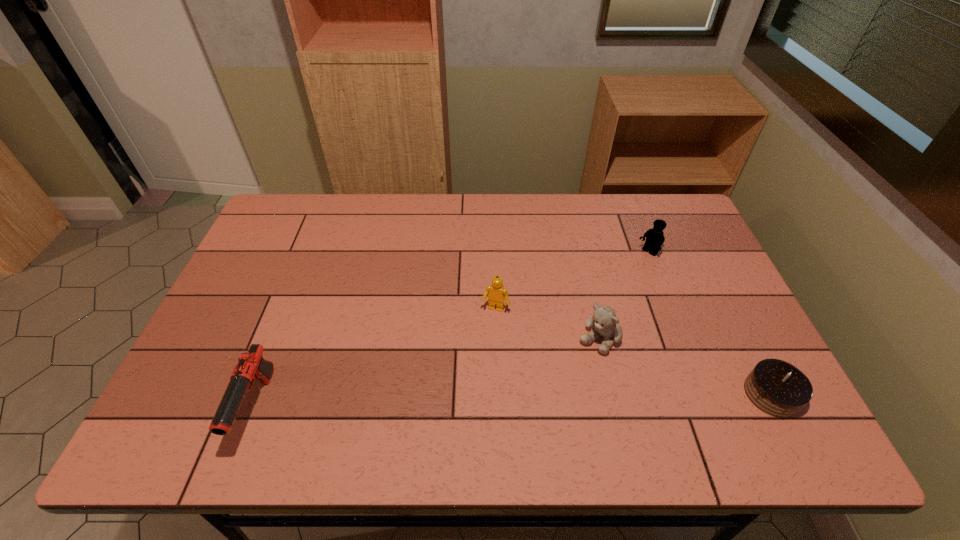
Where is `free space located 0.170m on the face of the fourth nearest object`? The height and width of the screenshot is (540, 960). free space located 0.170m on the face of the fourth nearest object is located at coordinates (473, 366).

Identify the location of vacant position located on the face of the fourth nearest object. The height and width of the screenshot is (540, 960). (465, 390).

Locate an element on the screen. free space located 0.230m on the face of the fourth nearest object is located at coordinates (466, 387).

I want to click on free space located 0.140m on the face of the third nearest object, so click(558, 390).

Locate an element on the screen. Image resolution: width=960 pixels, height=540 pixels. vacant space located on the face of the third nearest object is located at coordinates (558, 390).

The width and height of the screenshot is (960, 540). I want to click on vacant space located 0.130m on the face of the third nearest object, so click(x=560, y=388).

Find the location of a particular element. Image resolution: width=960 pixels, height=540 pixels. free region located on the front-facing side of the farther Lego is located at coordinates (623, 274).

The image size is (960, 540). I want to click on free space located on the front-facing side of the farther Lego, so click(596, 295).

At what (x,y) coordinates should I click in order to perform the action: click on free location located 0.380m on the front-facing side of the farther Lego. Please return your answer as a coordinate pair (x, y). The height and width of the screenshot is (540, 960). Looking at the image, I should click on (562, 324).

This screenshot has height=540, width=960. I want to click on gun situated at the near edge, so click(251, 364).